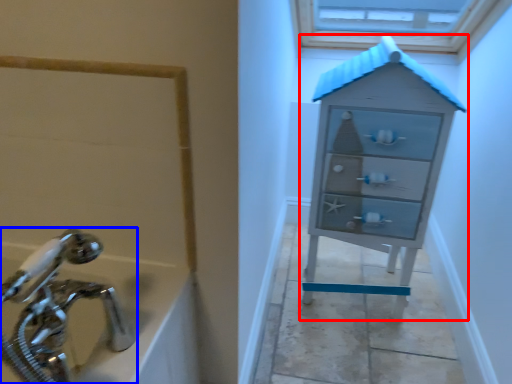
Question: Which object is further to the camera taking this photo, chest of drawers (highlighted by a red box) or tap (highlighted by a blue box)?

Choices:
 (A) chest of drawers
 (B) tap

Answer: (A)